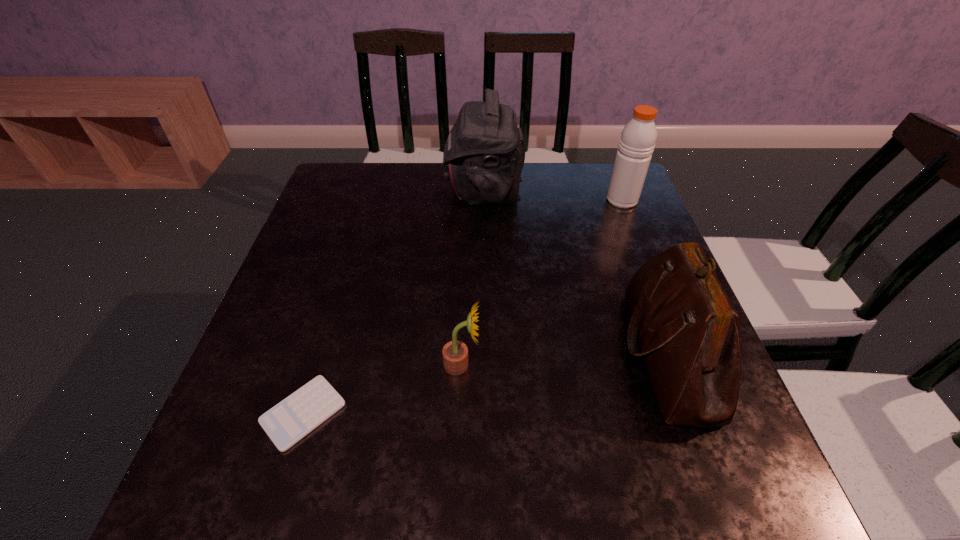
You are a GUI agent. You are given a task and a screenshot of the screen. Output one action in this format:
    pyautogui.click(x=<x>, y=<y>)
    Task: Click on the free point at the left edge
    Image resolution: width=960 pixels, height=540 pixels.
    Given the screenshot: What is the action you would take?
    pyautogui.click(x=307, y=435)

Locate an element on the screen. This screenshot has height=540, width=960. vacant area at the right edge is located at coordinates (647, 238).

At what (x,y) coordinates should I click in order to perform the action: click on free space at the far right corner of the desktop. Please return your answer as a coordinate pair (x, y). This screenshot has height=540, width=960. Looking at the image, I should click on (612, 207).

Where is `free space at the near right corner of the desktop`? Image resolution: width=960 pixels, height=540 pixels. free space at the near right corner of the desktop is located at coordinates (736, 469).

Locate an element on the screen. The image size is (960, 540). unoccupied position between the calculator and the shaker is located at coordinates (463, 306).

At what (x,y) coordinates should I click in order to perform the action: click on blank region between the sunflower and the nearer shoulder bag. Please return your answer as a coordinate pair (x, y). This screenshot has height=540, width=960. Looking at the image, I should click on (564, 359).

Identify the location of free spot between the shortest object and the farther shoulder bag. The height and width of the screenshot is (540, 960). (394, 301).

This screenshot has width=960, height=540. In order to click on vacant area between the right shoulder bag and the sunflower in this screenshot , I will do pyautogui.click(x=564, y=359).

Where is `vacant area that lies between the shortest object and the fourth tallest object`? This screenshot has height=540, width=960. vacant area that lies between the shortest object and the fourth tallest object is located at coordinates (382, 389).

Locate an element on the screen. This screenshot has width=960, height=540. vacant point located between the leftmost object and the fourth tallest object is located at coordinates (382, 389).